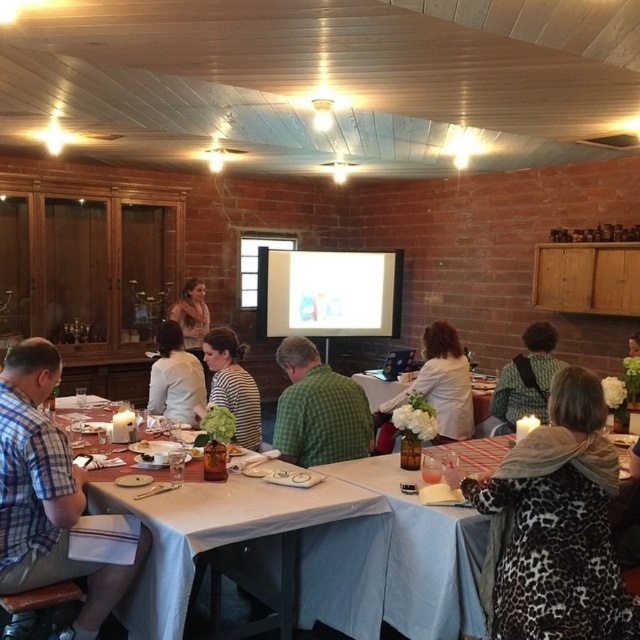
Question: Can you confirm if plaid shirt at left is thinner than leather jacket at center?

Choices:
 (A) yes
 (B) no

Answer: (B)

Question: Can you confirm if white shirt at center is bigger than light blue tablecloth at center?

Choices:
 (A) yes
 (B) no

Answer: (A)

Question: Is white cloth table at center in front of green checkered shirt at center?

Choices:
 (A) yes
 (B) no

Answer: (A)

Question: Which point is closer to the camera taking this photo?

Choices:
 (A) (4, 486)
 (B) (212, 353)
 (C) (404, 384)
 (D) (188, 289)

Answer: (A)

Question: Which of the following is the closest to the observer?

Choices:
 (A) (20, 490)
 (B) (186, 394)

Answer: (A)

Question: Which point is farther to the camera?

Choices:
 (A) (369, 396)
 (B) (90, 582)
 (C) (394, 636)

Answer: (A)